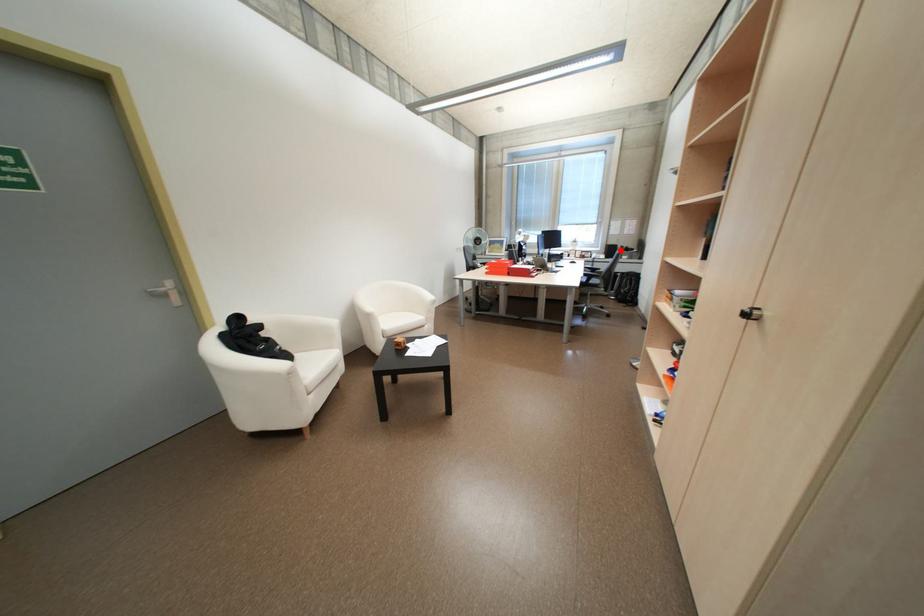
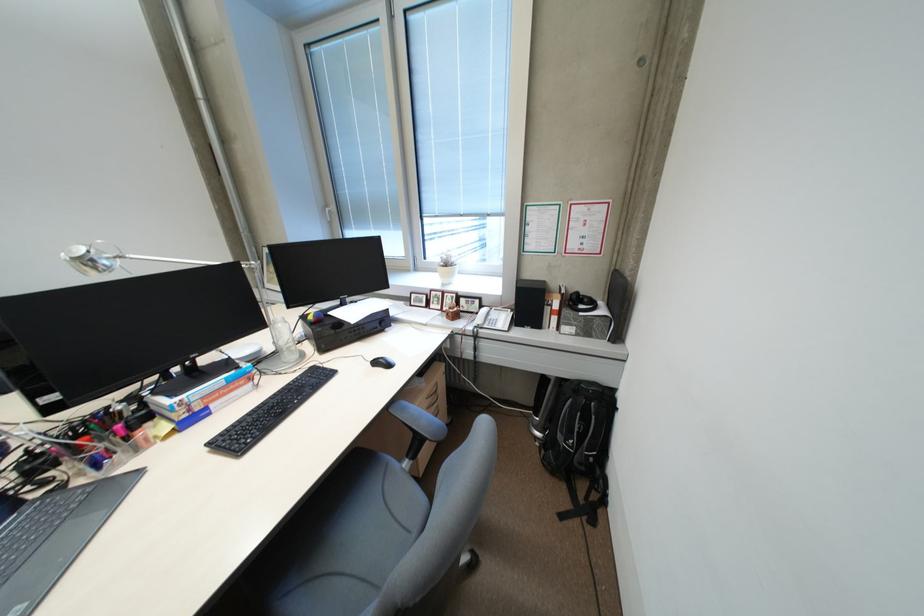
Question: I am providing you with two images of the same scene from different viewpoints. Given a red point in image1, look at the same physical point in image2. Is it:

Choices:
 (A) Closer to the viewpoint
 (B) Farther from the viewpoint

Answer: (B)